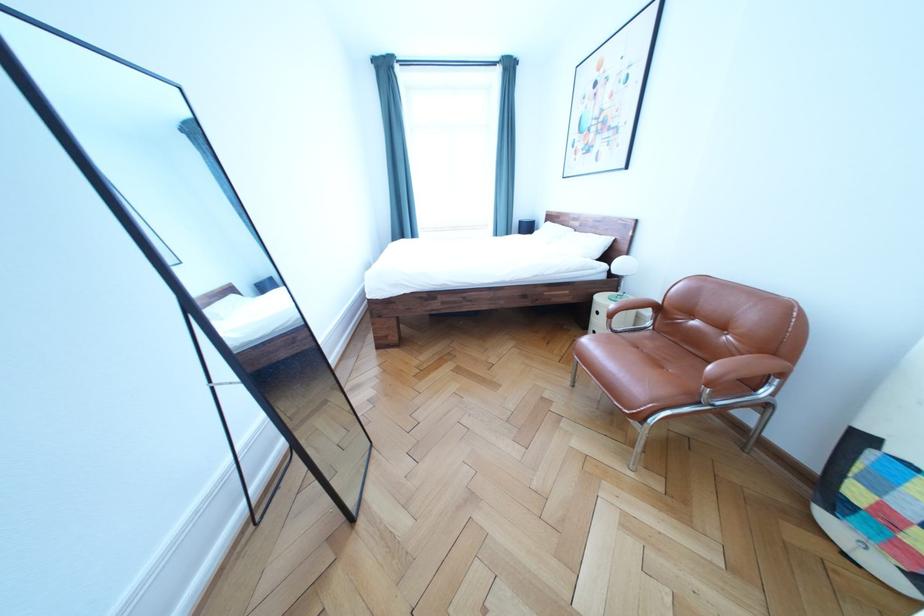
Image resolution: width=924 pixels, height=616 pixels. I want to click on chair sitting surface, so click(696, 354).